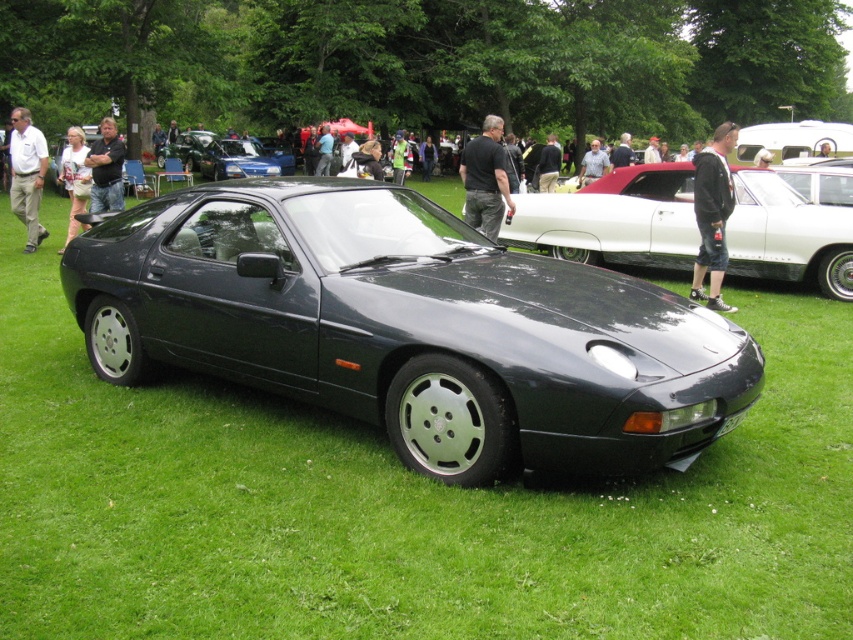
You are standing at the entrance of the car show and want to take a photo of the point at coordinate point (68, 170). The camera you have can focus on objects up to 15 meters away. Will the camera be able to focus on that point?

The distance of point (68, 170) from camera is 12.62 meters, which is within the camera focus range of 15 meters. Therefore, the camera can focus on that point.

You are at a car show and notice a metallic blue car at center and a white cotton shirt at left. Which object is taller?

The white cotton shirt at left is taller than the metallic blue car at center.